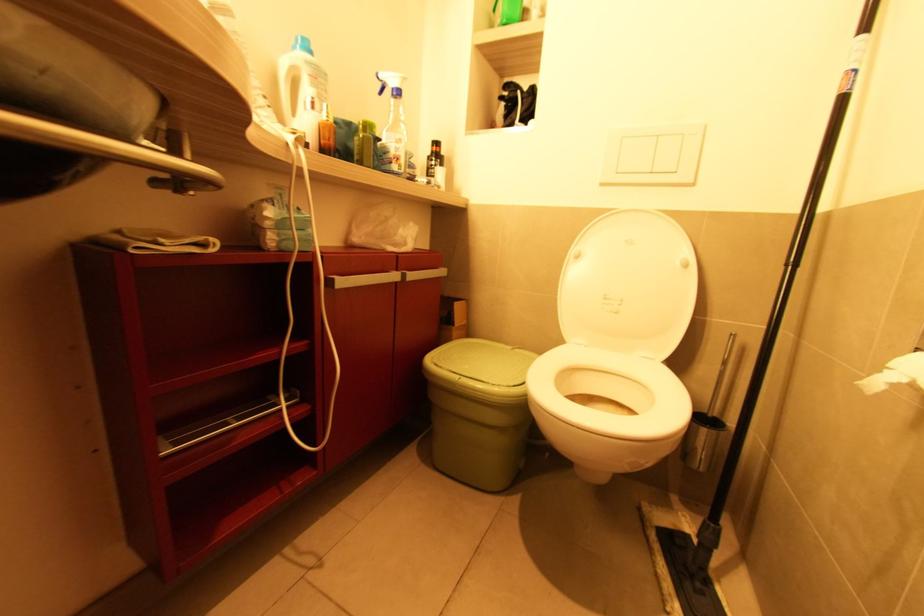
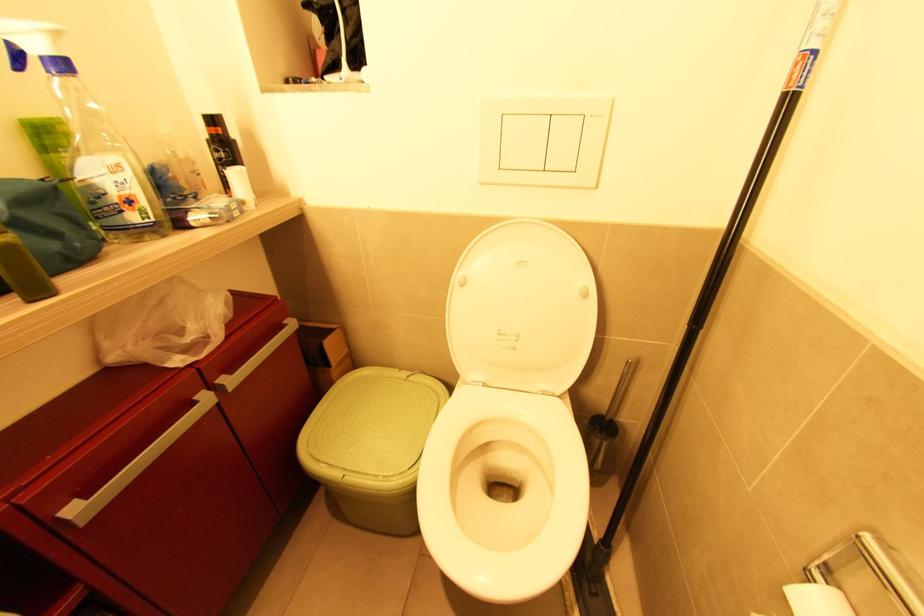
Question: Based on the continuous images, in which direction is the camera rotating? Reply with the corresponding letter.

Choices:
 (A) Left
 (B) Right
 (C) Up
 (D) Down

Answer: (D)